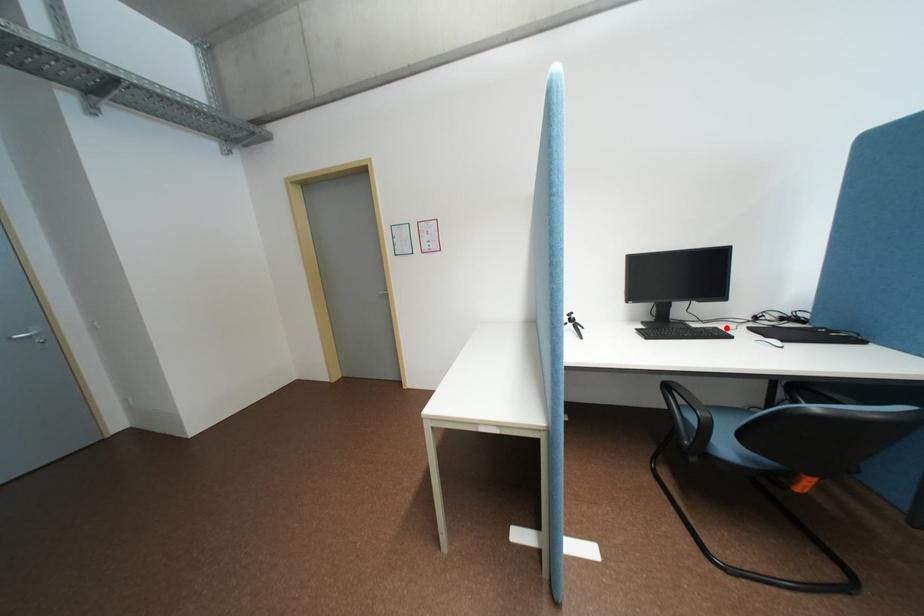
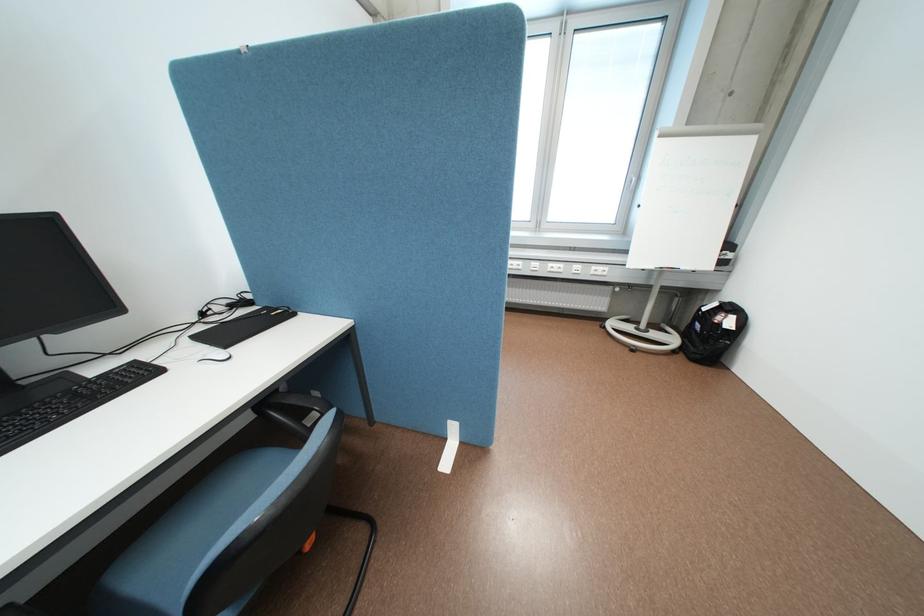
Find the pixel in the second image that matches the highlighted location in the first image.

(146, 362)